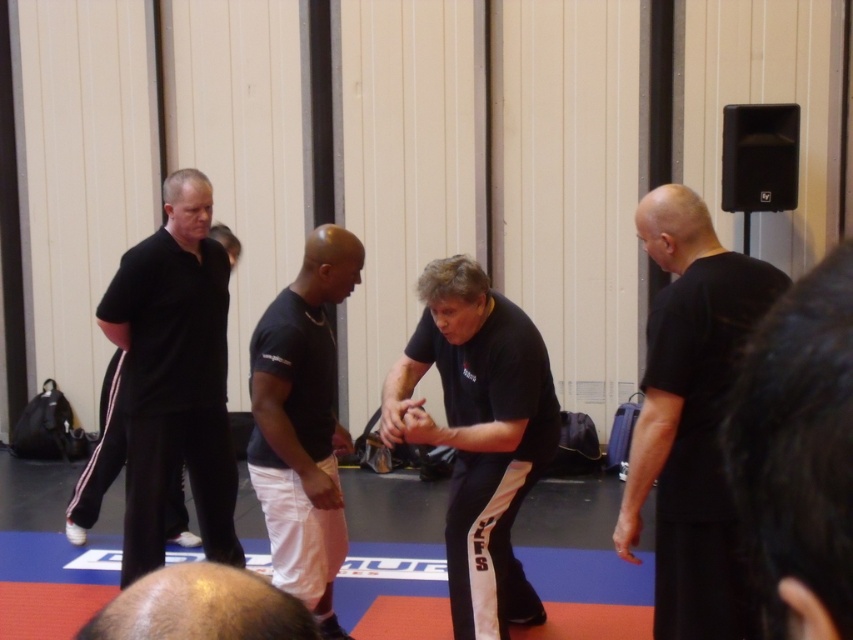
Question: Is black matte shirt at right above black cotton shirt at center?

Choices:
 (A) no
 (B) yes

Answer: (B)

Question: Which object is closer to the camera taking this photo?

Choices:
 (A) black matte shirt at right
 (B) bald head at center

Answer: (B)

Question: Which point appears farthest from the camera in this image?

Choices:
 (A) (277, 317)
 (B) (708, 365)
 (C) (225, 589)
 (D) (498, 340)

Answer: (A)

Question: Does black matte hair at upper right appear over black matte pants at center?

Choices:
 (A) no
 (B) yes

Answer: (B)

Question: Which of the following is the farthest from the observer?

Choices:
 (A) (216, 518)
 (B) (428, 362)
 (C) (323, 524)

Answer: (A)

Question: Does black matte shirt at right lie behind black matte hair at upper right?

Choices:
 (A) no
 (B) yes

Answer: (B)